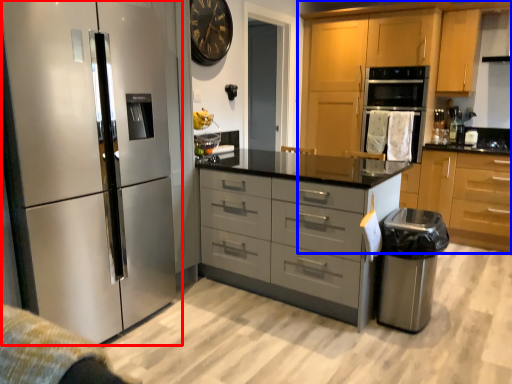
Question: Among these objects, which one is nearest to the camera, refrigerator (highlighted by a red box) or cabinetry (highlighted by a blue box)?

Choices:
 (A) refrigerator
 (B) cabinetry

Answer: (A)